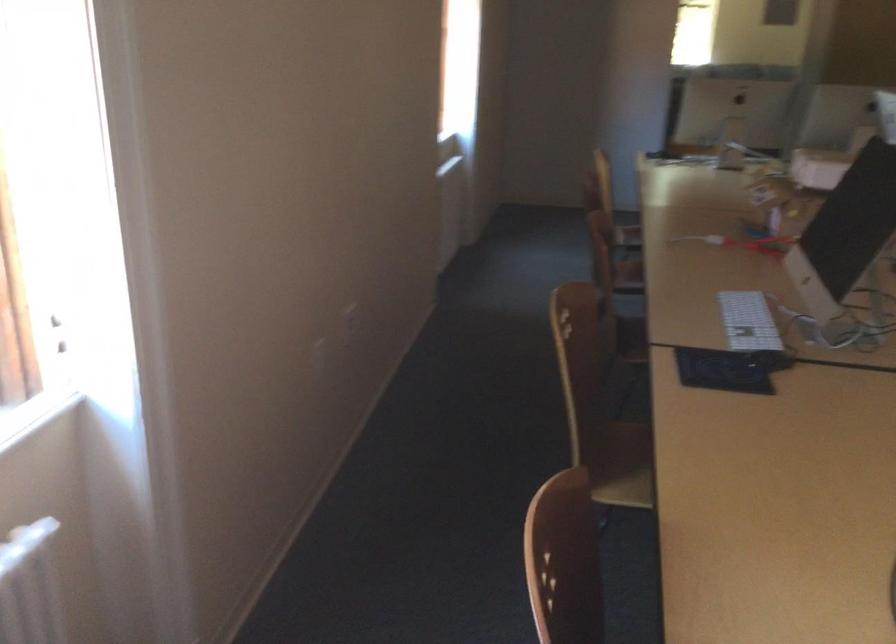
Which object does [747,321] point to?

It corresponds to the white keyboard in the image.